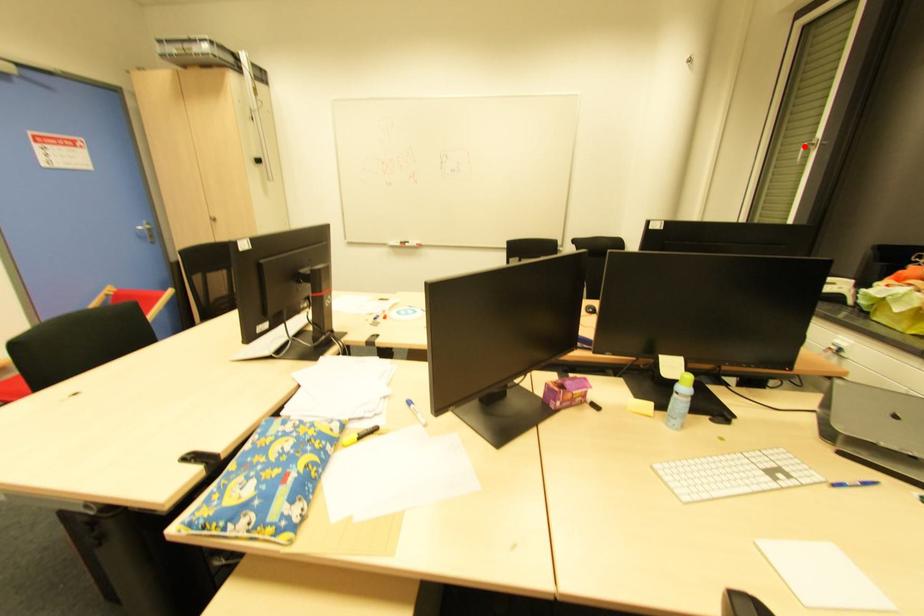
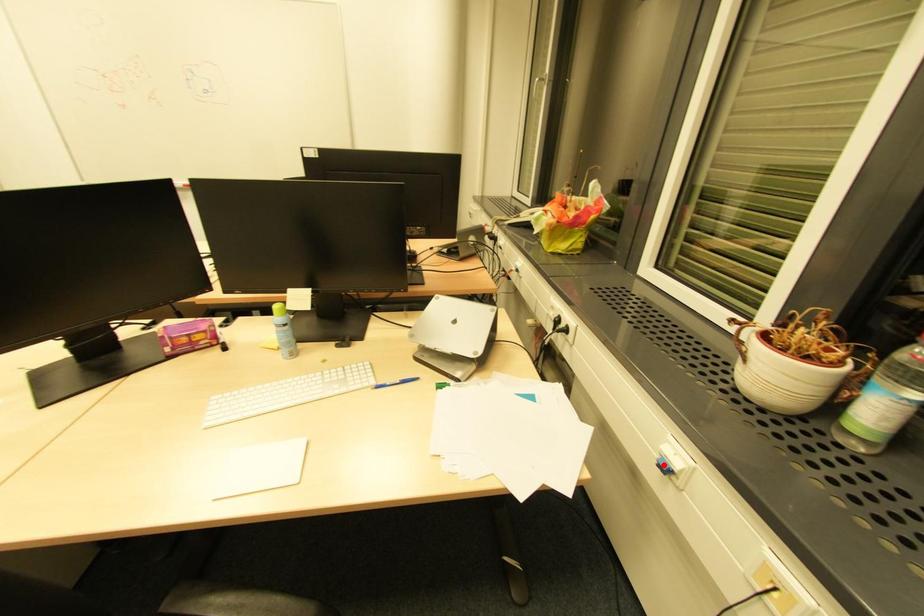
I am providing you with two images of the same scene from different viewpoints. A red point is marked on the first image and another point is marked on the second image. Is the red point in image1 aligned with the point shown in image2?

No